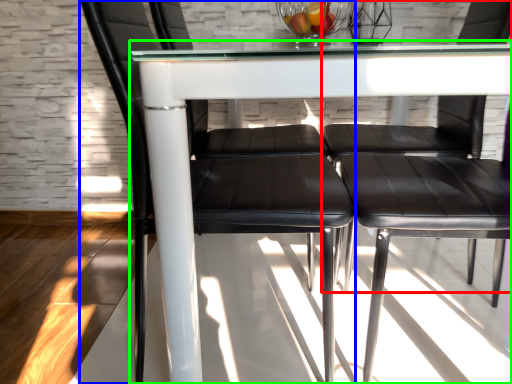
Question: Which object is the closest to the chair (highlighted by a red box)? Choose among these: chair (highlighted by a blue box) or table (highlighted by a green box).

Choices:
 (A) chair
 (B) table

Answer: (A)